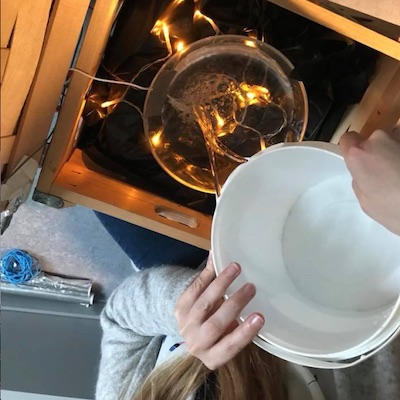
Find the location of a particular element. This screenshot has width=400, height=400. string lights is located at coordinates (260, 94).